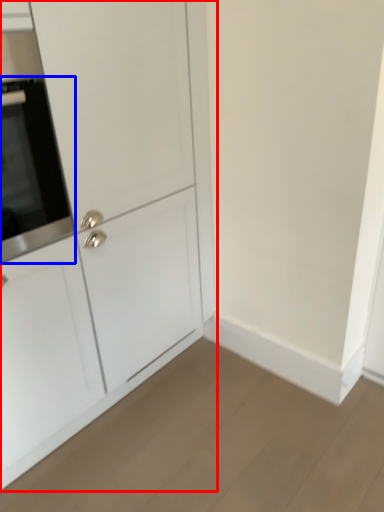
Question: Which object appears farthest to the camera in this image, cabinetry (highlighted by a red box) or oven (highlighted by a blue box)?

Choices:
 (A) cabinetry
 (B) oven

Answer: (B)